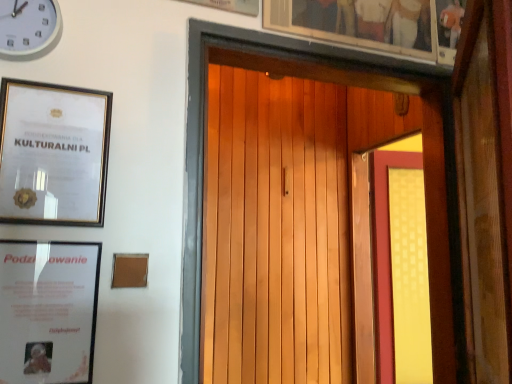
At what (x,y) coordinates should I click in order to perform the action: click on white plastic clock at upper left. Please return your answer as a coordinate pair (x, y). Looking at the image, I should click on (29, 28).

Describe the element at coordinates (391, 266) in the screenshot. I see `yellow matte screen door at right` at that location.

What do you see at coordinates (358, 23) in the screenshot? I see `wooden picture frame at upper center, the first picture frame when ordered from right to left` at bounding box center [358, 23].

Where is `matte white picture frame at lower left, which is the 1th picture frame in left-to-right order`? This screenshot has height=384, width=512. matte white picture frame at lower left, which is the 1th picture frame in left-to-right order is located at coordinates (48, 311).

Find the location of `wooden picture frame at upper center, which is counted as the 2th picture frame, starting from the right`. wooden picture frame at upper center, which is counted as the 2th picture frame, starting from the right is located at coordinates (231, 5).

Which is nearer, (60, 185) or (335, 81)?

The point (60, 185) is in front.

What's the angular difference between gold-framed certificate at upper left, the second picture frame from the left, and wooden door at center's facing directions?

gold-framed certificate at upper left, the second picture frame from the left, and wooden door at center are facing 0.000186 degrees away from each other.

From the picture: Are gold-framed certificate at upper left, placed as the 3th picture frame when sorted from top to bottom, and wooden door at center located far from each other?

That's not correct — gold-framed certificate at upper left, placed as the 3th picture frame when sorted from top to bottom, is a little close to wooden door at center.

From the image's perspective, who appears lower, wooden picture frame at upper center, the 4th picture frame positioned from the left, or wooden picture frame at upper center, the 4th picture frame from the bottom?

wooden picture frame at upper center, the 4th picture frame positioned from the left.

Is wooden picture frame at upper center, the 4th picture frame positioned from the left, taller than wooden picture frame at upper center, the first picture frame viewed from the top?

No, wooden picture frame at upper center, the 4th picture frame positioned from the left, is not taller than wooden picture frame at upper center, the first picture frame viewed from the top.

Locate an element on the screen. Image resolution: width=512 pixels, height=384 pixels. the 1st picture frame in front of the wooden picture frame at upper center, positioned as the 3th picture frame in bottom-to-top order is located at coordinates (231, 5).

Who is smaller, wooden picture frame at upper center, positioned as the 3th picture frame in bottom-to-top order, or wooden picture frame at upper center, the 4th picture frame from the bottom?

Smaller between the two is wooden picture frame at upper center, positioned as the 3th picture frame in bottom-to-top order.

In terms of height, does yellow matte screen door at right look taller or shorter compared to wooden picture frame at upper center, the first picture frame viewed from the top?

yellow matte screen door at right is taller than wooden picture frame at upper center, the first picture frame viewed from the top.

Looking at this image, from a real-world perspective, who is located higher, yellow matte screen door at right or wooden picture frame at upper center, the third picture frame in the left-to-right sequence?

wooden picture frame at upper center, the third picture frame in the left-to-right sequence, is physically above.

Is yellow matte screen door at right facing away from wooden picture frame at upper center, the third picture frame in the left-to-right sequence?

No, yellow matte screen door at right is not facing away from wooden picture frame at upper center, the third picture frame in the left-to-right sequence.

From the image's perspective, which one is positioned lower, matte white picture frame at lower left, the first picture frame from the bottom, or white plastic clock at upper left?

From the image's view, matte white picture frame at lower left, the first picture frame from the bottom, is below.

Can you confirm if matte white picture frame at lower left, which is the 1th picture frame in left-to-right order, is thinner than white plastic clock at upper left?

Yes, matte white picture frame at lower left, which is the 1th picture frame in left-to-right order, is thinner than white plastic clock at upper left.

Does matte white picture frame at lower left, the first picture frame from the bottom, turn towards white plastic clock at upper left?

No, matte white picture frame at lower left, the first picture frame from the bottom, is not oriented towards white plastic clock at upper left.

From a real-world perspective, which object rests below the other?

matte white picture frame at lower left, which ranks as the fourth picture frame in top-to-bottom order, from a real-world perspective.

Looking at this image, measure the distance between yellow matte screen door at right and white plastic clock at upper left.

They are 1.97 meters apart.

From a real-world perspective, is yellow matte screen door at right under white plastic clock at upper left?

Yes, from a real-world perspective, yellow matte screen door at right is beneath white plastic clock at upper left.

In the scene shown: Is white plastic clock at upper left inside yellow matte screen door at right?

No, white plastic clock at upper left is not inside yellow matte screen door at right.

From the image's perspective, which one is positioned higher, yellow matte screen door at right or white plastic clock at upper left?

From the image's view, white plastic clock at upper left is above.

Does white plastic clock at upper left have a greater height compared to matte white picture frame at lower left, which ranks as the fourth picture frame in top-to-bottom order?

No.

Does white plastic clock at upper left have a smaller size compared to matte white picture frame at lower left, which is the 1th picture frame in left-to-right order?

Yes, white plastic clock at upper left is smaller than matte white picture frame at lower left, which is the 1th picture frame in left-to-right order.

Considering the relative positions of white plastic clock at upper left and matte white picture frame at lower left, which is the 1th picture frame in left-to-right order, in the image provided, is white plastic clock at upper left to the right of matte white picture frame at lower left, which is the 1th picture frame in left-to-right order, from the viewer's perspective?

Incorrect, white plastic clock at upper left is not on the right side of matte white picture frame at lower left, which is the 1th picture frame in left-to-right order.

From a real-world perspective, which object stands above the other?

From a 3D spatial view, white plastic clock at upper left is above.

You are a GUI agent. You are given a task and a screenshot of the screen. Output one action in this format:
    pyautogui.click(x=<x>, y=<y>)
    Task: Click on the picture frame on the right of wooden door at center
    The width and height of the screenshot is (512, 384).
    Given the screenshot: What is the action you would take?
    pyautogui.click(x=358, y=23)

From a real-world perspective, who is located higher, wooden door at center or wooden picture frame at upper center, positioned as the 3th picture frame in bottom-to-top order?

wooden picture frame at upper center, positioned as the 3th picture frame in bottom-to-top order.

Is wooden door at center inside or outside of wooden picture frame at upper center, positioned as the 3th picture frame in bottom-to-top order?

wooden door at center is spatially situated outside wooden picture frame at upper center, positioned as the 3th picture frame in bottom-to-top order.

Could you tell me if wooden door at center is turned towards wooden picture frame at upper center, the first picture frame when ordered from right to left?

No, wooden door at center is not aimed at wooden picture frame at upper center, the first picture frame when ordered from right to left.

Locate an element on the screen. This screenshot has width=512, height=384. the 1st picture frame in front of the wooden door at center is located at coordinates (53, 153).

The width and height of the screenshot is (512, 384). What are the coordinates of `the 1st picture frame to the left of the wooden picture frame at upper center, positioned as the 3th picture frame in bottom-to-top order, counting from the anchor's position` in the screenshot? It's located at (231, 5).

Based on the photo, considering their positions, is gold-framed certificate at upper left, placed as the 3th picture frame when sorted from top to bottom, positioned further to wooden door at center than wooden picture frame at upper center, the third picture frame in the left-to-right sequence?

wooden picture frame at upper center, the third picture frame in the left-to-right sequence.

When comparing their distances from yellow matte screen door at right, does matte white picture frame at lower left, the first picture frame from the bottom, or wooden door at center seem closer?

wooden door at center is closer to yellow matte screen door at right.

When comparing their distances from matte white picture frame at lower left, which is the fourth picture frame from right to left, does wooden picture frame at upper center, the 4th picture frame from the bottom, or white plastic clock at upper left seem closer?

white plastic clock at upper left is closer to matte white picture frame at lower left, which is the fourth picture frame from right to left.

Looking at the image, which one is located further to matte white picture frame at lower left, which is the fourth picture frame from right to left, wooden picture frame at upper center, which ranks as the second picture frame in top-to-bottom order, or yellow matte screen door at right?

The object further to matte white picture frame at lower left, which is the fourth picture frame from right to left, is yellow matte screen door at right.

Estimate the real-world distances between objects in this image. Which object is closer to wooden picture frame at upper center, the 4th picture frame from the bottom, wooden door at center or gold-framed certificate at upper left, the 3th picture frame from the right?

Among the two, wooden door at center is located nearer to wooden picture frame at upper center, the 4th picture frame from the bottom.

Based on their spatial positions, is wooden picture frame at upper center, the third picture frame in the left-to-right sequence, or wooden picture frame at upper center, positioned as the 3th picture frame in bottom-to-top order, closer to matte white picture frame at lower left, which is the fourth picture frame from right to left?

wooden picture frame at upper center, the third picture frame in the left-to-right sequence, is positioned closer to the anchor matte white picture frame at lower left, which is the fourth picture frame from right to left.

Based on their spatial positions, is gold-framed certificate at upper left, the second picture frame from the left, or yellow matte screen door at right closer to white plastic clock at upper left?

gold-framed certificate at upper left, the second picture frame from the left, is positioned closer to the anchor white plastic clock at upper left.

Consider the image. Based on their spatial positions, is yellow matte screen door at right or gold-framed certificate at upper left, the second picture frame from the left, closer to white plastic clock at upper left?

Based on the image, gold-framed certificate at upper left, the second picture frame from the left, appears to be nearer to white plastic clock at upper left.

Identify the location of door between wooden picture frame at upper center, positioned as the 3th picture frame in bottom-to-top order, and yellow matte screen door at right in the up-down direction. (337, 83).

Where is `door located between white plastic clock at upper left and yellow matte screen door at right in the left-right direction`? This screenshot has height=384, width=512. door located between white plastic clock at upper left and yellow matte screen door at right in the left-right direction is located at coordinates (337, 83).

Image resolution: width=512 pixels, height=384 pixels. In order to click on door between gold-framed certificate at upper left, placed as the 3th picture frame when sorted from top to bottom, and wooden picture frame at upper center, the 4th picture frame positioned from the left in this screenshot , I will do `click(337, 83)`.

Image resolution: width=512 pixels, height=384 pixels. Identify the location of door between matte white picture frame at lower left, which ranks as the fourth picture frame in top-to-bottom order, and yellow matte screen door at right, in the horizontal direction. (337, 83).